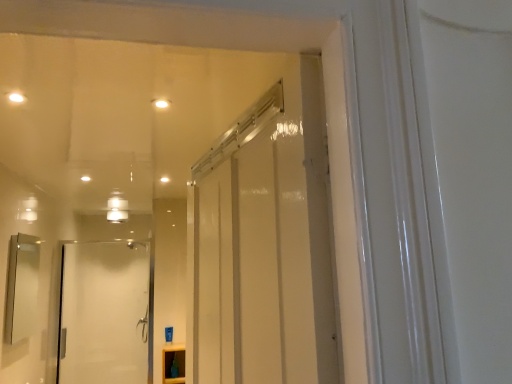
Question: From the image's perspective, is matte white cabinet at lower center located above white glass door at left?

Choices:
 (A) no
 (B) yes

Answer: (A)

Question: Is matte white cabinet at lower center facing away from white glass door at left?

Choices:
 (A) no
 (B) yes

Answer: (A)

Question: Considering the relative sizes of matte white cabinet at lower center and white glass door at left in the image provided, is matte white cabinet at lower center wider than white glass door at left?

Choices:
 (A) yes
 (B) no

Answer: (A)

Question: Is matte white cabinet at lower center with white glass door at left?

Choices:
 (A) no
 (B) yes

Answer: (A)

Question: Is matte white cabinet at lower center positioned behind white glass door at left?

Choices:
 (A) no
 (B) yes

Answer: (A)

Question: From their relative heights in the image, would you say white glass door at left is taller or shorter than matte white cabinet at lower center?

Choices:
 (A) short
 (B) tall

Answer: (B)

Question: In terms of size, does white glass door at left appear bigger or smaller than matte white cabinet at lower center?

Choices:
 (A) small
 (B) big

Answer: (B)

Question: Does point (110, 296) appear closer or farther from the camera than point (178, 369)?

Choices:
 (A) closer
 (B) farther

Answer: (B)

Question: From a real-world perspective, is white glass door at left above or below matte white cabinet at lower center?

Choices:
 (A) below
 (B) above

Answer: (B)

Question: Is point (177, 382) positioned closer to the camera than point (76, 286)?

Choices:
 (A) farther
 (B) closer

Answer: (B)

Question: From a real-world perspective, is matte white cabinet at lower center above or below white glass door at left?

Choices:
 (A) below
 (B) above

Answer: (A)

Question: Based on their sizes in the image, would you say matte white cabinet at lower center is bigger or smaller than white glass door at left?

Choices:
 (A) small
 (B) big

Answer: (A)

Question: Which is correct: matte white cabinet at lower center is inside white glass door at left, or outside of it?

Choices:
 (A) outside
 (B) inside

Answer: (A)

Question: From a real-world perspective, is matte silver mirror at left above or below matte white cabinet at lower center?

Choices:
 (A) above
 (B) below

Answer: (A)

Question: In terms of height, does matte silver mirror at left look taller or shorter compared to matte white cabinet at lower center?

Choices:
 (A) short
 (B) tall

Answer: (B)